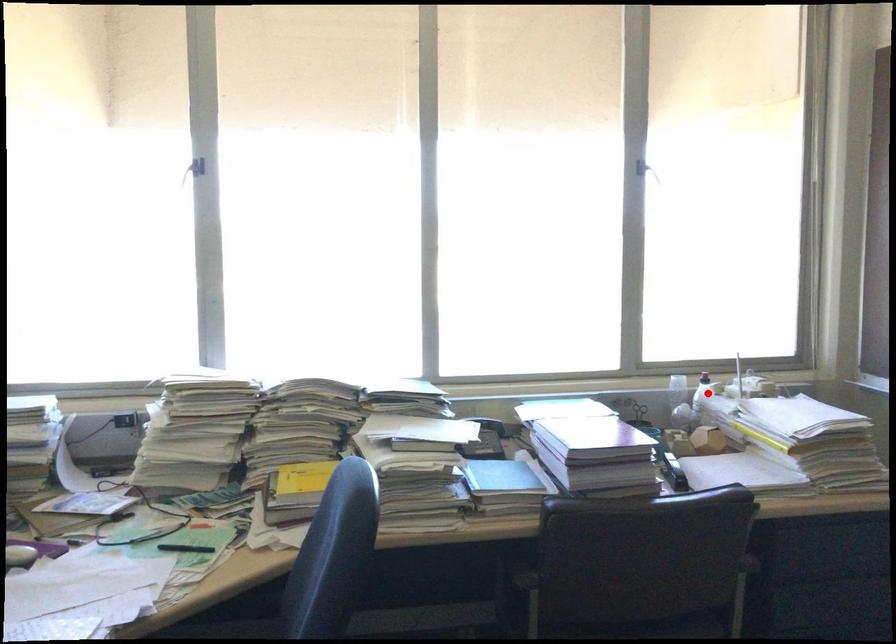
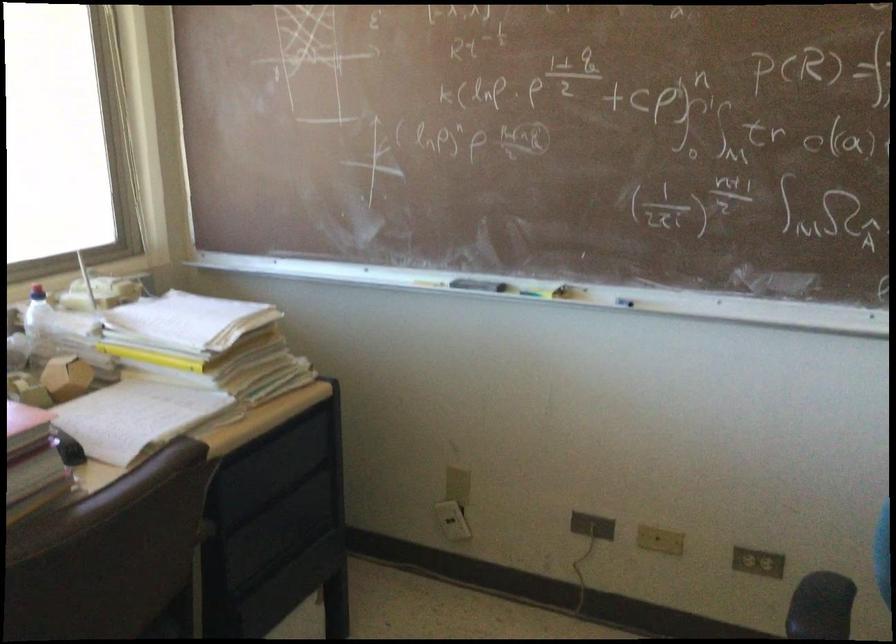
Question: I am providing you with two images of the same scene from different viewpoints. In image1, a red point is highlighted. Considering the same 3D point in image2, which of the following is correct?

Choices:
 (A) It is closer
 (B) It is farther

Answer: (A)